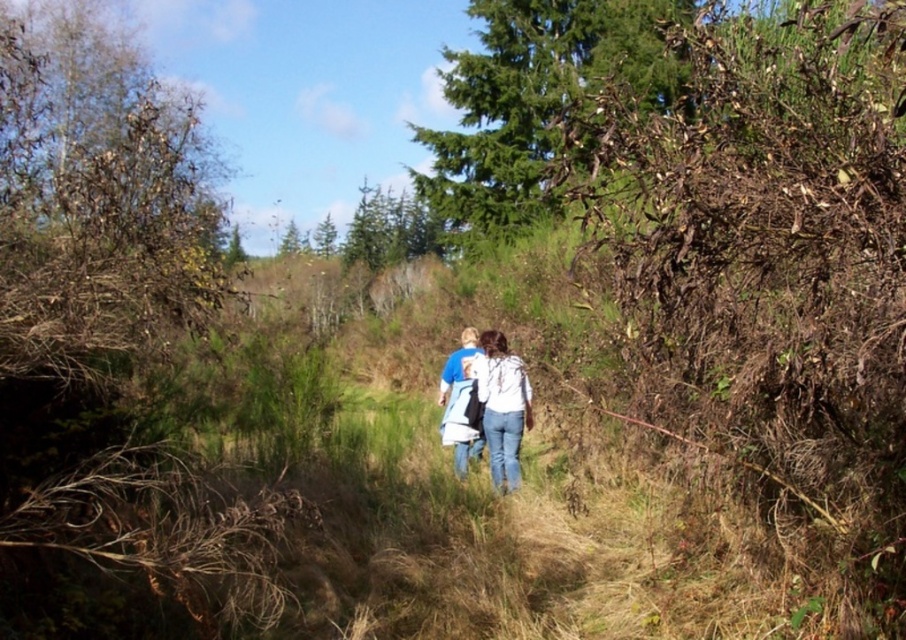
Does green textured tree at upper center have a greater height compared to white cotton shirt at center?

Yes, green textured tree at upper center is taller than white cotton shirt at center.

What do you see at coordinates (537, 104) in the screenshot? This screenshot has height=640, width=906. I see `green textured tree at upper center` at bounding box center [537, 104].

Where is `green textured tree at upper center`? green textured tree at upper center is located at coordinates (537, 104).

Who is positioned more to the right, white cotton shirt at center or green leafy tree at upper center?

From the viewer's perspective, white cotton shirt at center appears more on the right side.

Is white cotton shirt at center in front of green leafy tree at upper center?

Yes.

Who is more forward, [522,362] or [299,248]?

Point [522,362]

What are the coordinates of `white cotton shirt at center` in the screenshot? It's located at (485, 404).

The width and height of the screenshot is (906, 640). What do you see at coordinates (537, 104) in the screenshot? I see `green textured tree at upper center` at bounding box center [537, 104].

The width and height of the screenshot is (906, 640). What do you see at coordinates (537, 104) in the screenshot? I see `green textured tree at upper center` at bounding box center [537, 104].

You are a GUI agent. You are given a task and a screenshot of the screen. Output one action in this format:
    pyautogui.click(x=<x>, y=<y>)
    Task: Click on the green textured tree at upper center
    The width and height of the screenshot is (906, 640).
    Given the screenshot: What is the action you would take?
    pyautogui.click(x=537, y=104)